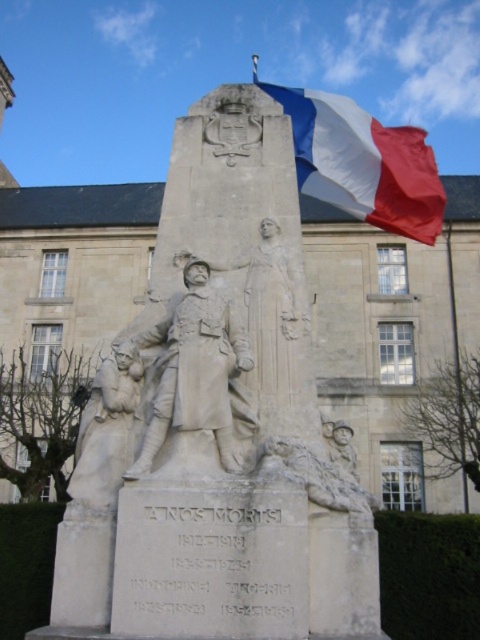
You are an architect designing a new memorial and want to ensure proper visibility between two key points on the monument. The first point is at coordinate point(322,154) and the second is at point(166,328). Based on the monument design, which point is closer to the viewer?

Point(166,328) is closer to the viewer because it is in front of point(322,154) according to the monument design.

You are a photographer planning to take a picture of the white marble monument at center and the tricolor fabric flag at upper right. To ensure both are clearly visible in the frame, which object should you focus on first, the one closer to you or the one farther away?

Since the white marble monument at center is in front of the tricolor fabric flag at upper right, you should focus on the white marble monument at center first as it is closer to you. This ensures both objects remain in focus when using depth of field techniques.

You are an architect designing a new memorial park. You need to place a new statue that is 2 meters wide. The white marble monument at center is currently at the park center. Can the statue be placed next to the tricolor fabric flag at upper right without overlapping with the monument?

The white marble monument at center has a lesser width compared to tricolor fabric flag at upper right. Since the monument is narrower, placing the 2m statue next to the flag might be feasible, but ensure there is enough space between them.